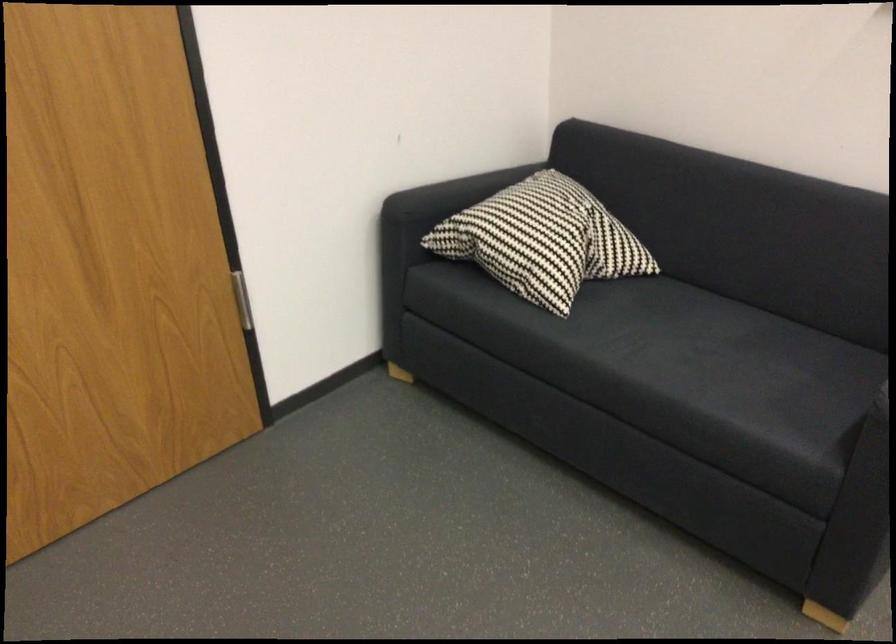
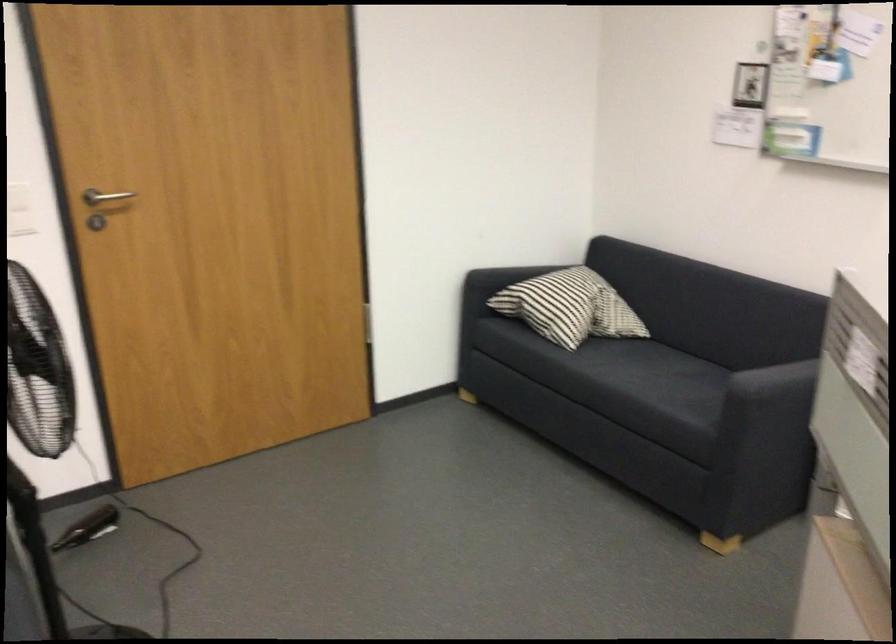
In the second image, find the point that corresponds to the point at 553,248 in the first image.

(570, 307)